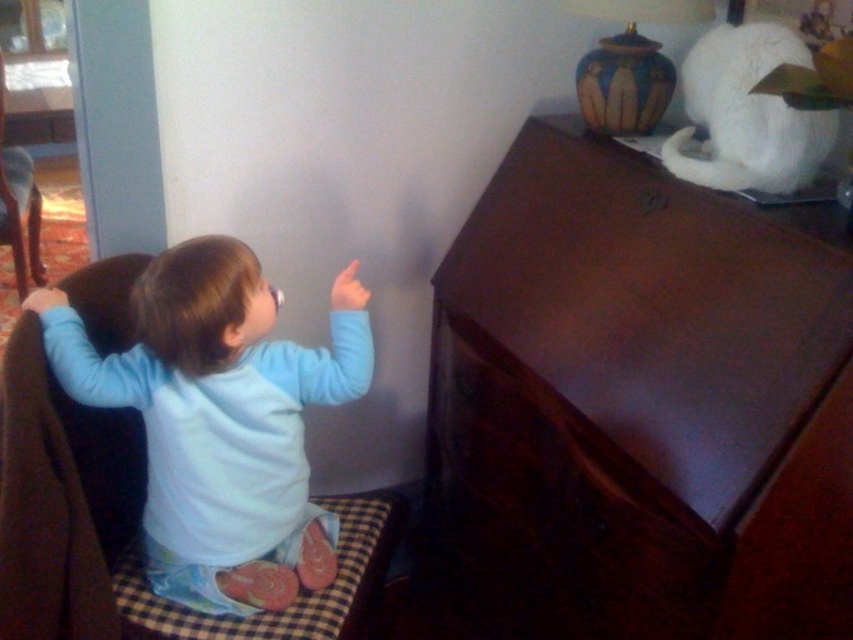
You are a photographer setting up a shoot in this scene. You need to place a small accessory between the dark wood dresser at upper right and the light blue fabric at upper left. Based on their positions, where should you place the accessory to ensure it is between them?

The dark wood dresser at upper right is located below the light blue fabric at upper left, so placing the accessory between them would require positioning it above the dark wood dresser at upper right and below the light blue fabric at upper left.

Looking at this image, you are helping to organize a child room. You have a new toy box that is 1.2 meters wide. You see the dark wood dresser at upper right and the dark wood drawer at center. Which one can fit the toy box if placed on its surface?

The dark wood dresser at upper right has a larger width than the dark wood drawer at center, so the toy box can fit on the dark wood dresser at upper right.

What is the color of the fabric at the point labeled as point (219, 420)?

The light blue fabric at upper left is represented by point (219, 420), so the color is light blue.